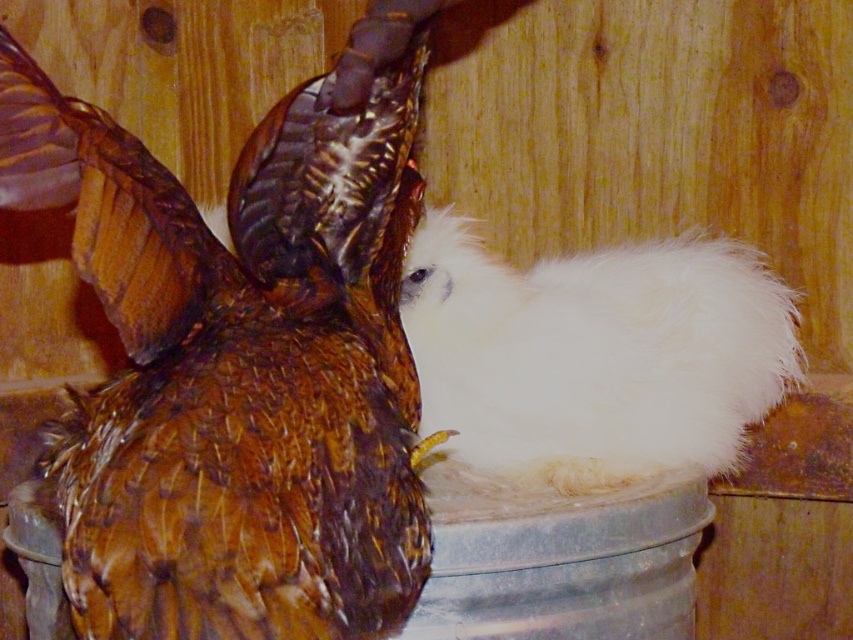
Question: Does brown feathered chicken at upper left have a lesser width compared to white fluffy chicken at center?

Choices:
 (A) yes
 (B) no

Answer: (A)

Question: Which point is closer to the camera?

Choices:
 (A) brown feathered chicken at upper left
 (B) white fluffy chicken at center

Answer: (A)

Question: Does brown feathered chicken at upper left have a greater width compared to white fluffy chicken at center?

Choices:
 (A) no
 (B) yes

Answer: (A)

Question: Is the position of brown feathered chicken at upper left more distant than that of white fluffy chicken at center?

Choices:
 (A) yes
 (B) no

Answer: (B)